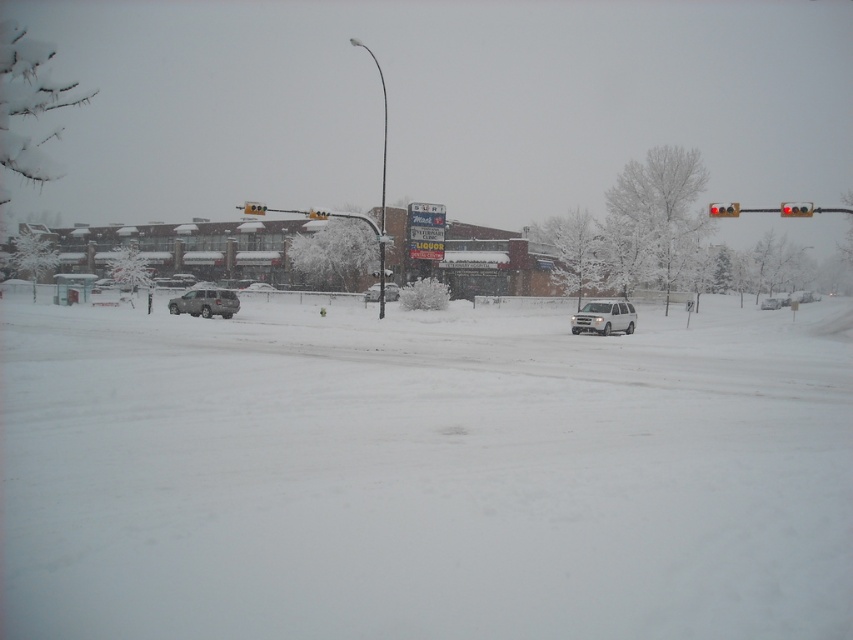
Question: Which object appears closest to the camera in this image?

Choices:
 (A) silver metallic suv at center
 (B) satin silver suv at left
 (C) red glass traffic light at upper right

Answer: (C)

Question: Which point is closer to the camera?

Choices:
 (A) white fluffy snow at center
 (B) satin silver suv at center

Answer: (A)

Question: Is white fluffy snow at center positioned in front of silver metallic suv at center?

Choices:
 (A) yes
 (B) no

Answer: (A)

Question: Which point is farther from the camera taking this photo?

Choices:
 (A) (782, 204)
 (B) (144, 493)

Answer: (A)

Question: Is satin silver suv at left positioned at the back of silver metallic suv at center?

Choices:
 (A) no
 (B) yes

Answer: (B)

Question: Is satin silver suv at left wider than red glass traffic light at upper right?

Choices:
 (A) yes
 (B) no

Answer: (B)